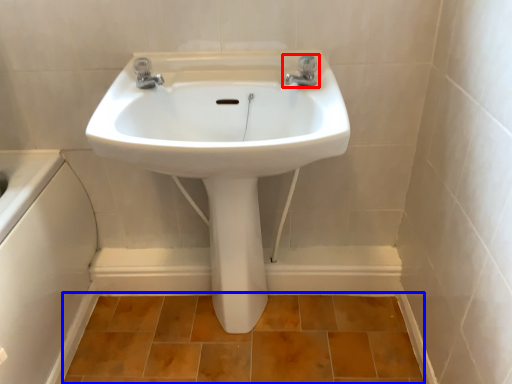
Question: Among these objects, which one is nearest to the camera, tap (highlighted by a red box) or ceramic tile (highlighted by a blue box)?

Choices:
 (A) tap
 (B) ceramic tile

Answer: (A)